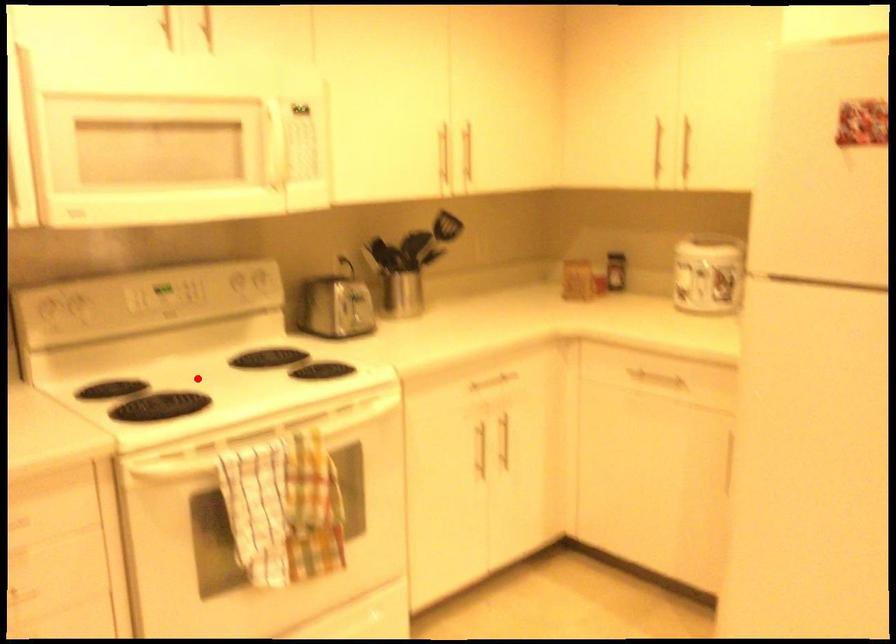
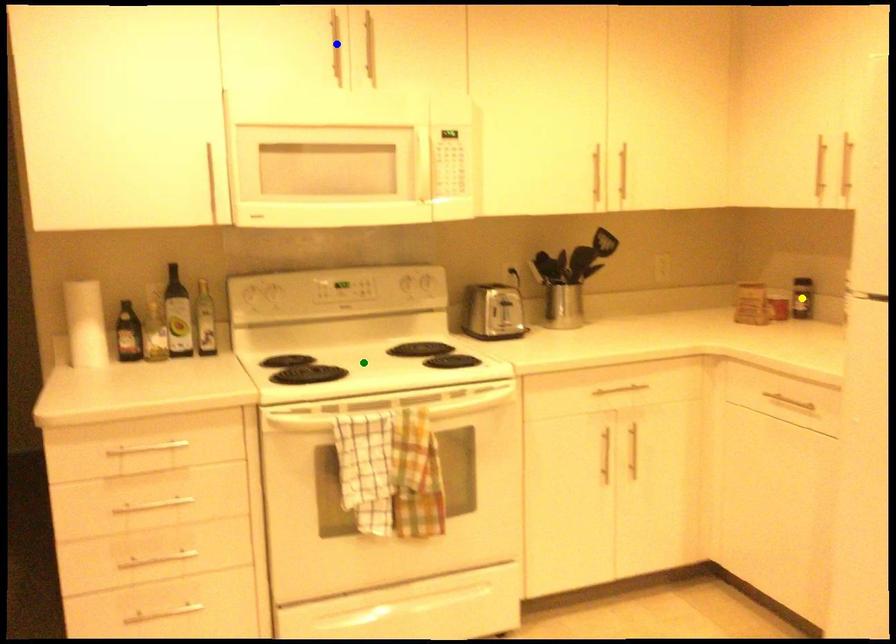
Question: I am providing you with two images of the same scene from different viewpoints. A red point is marked on the first image. You are given multiple points on the second image. In image 2, which mark is for the same physical point as the one in image 1?

Choices:
 (A) green point
 (B) blue point
 (C) yellow point

Answer: (A)